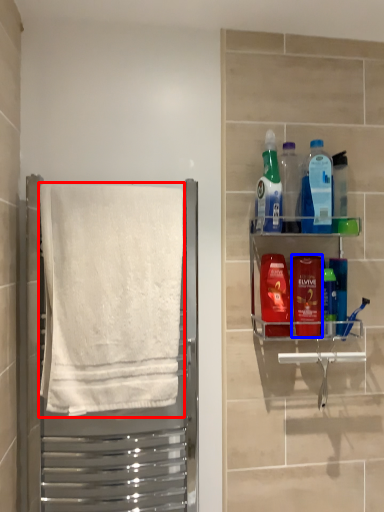
Question: Which object is closer to the camera taking this photo, towel (highlighted by a red box) or mouthwash (highlighted by a blue box)?

Choices:
 (A) towel
 (B) mouthwash

Answer: (A)